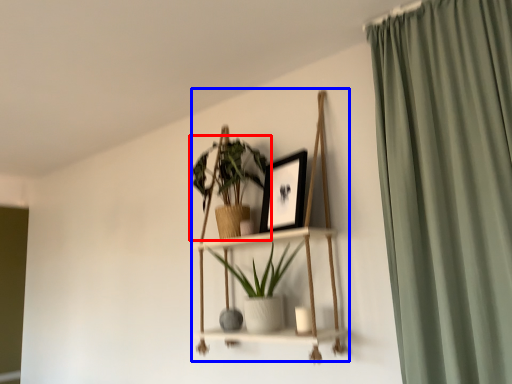
Question: Which of the following is the closest to the observer, houseplant (highlighted by a red box) or cabinet (highlighted by a blue box)?

Choices:
 (A) houseplant
 (B) cabinet

Answer: (B)